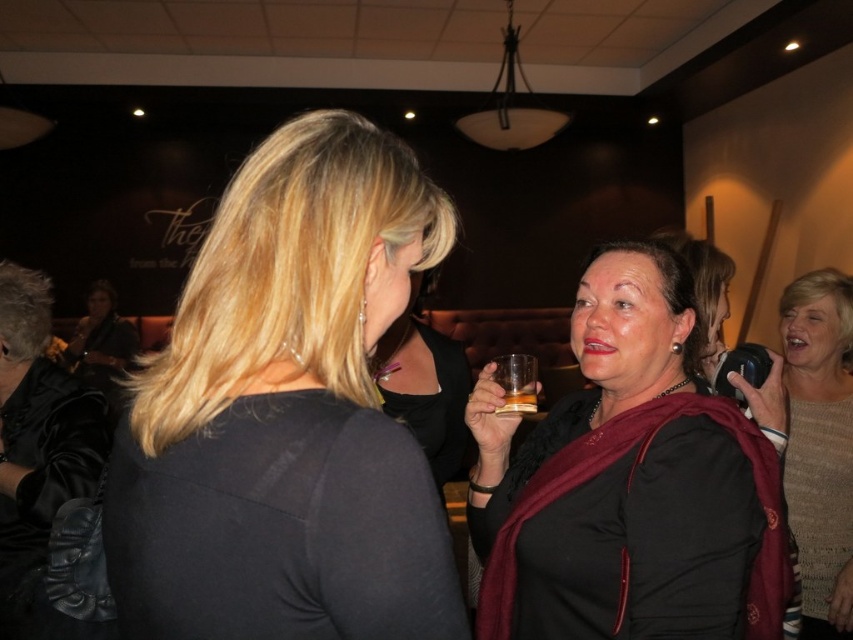
Question: Which of the following is the farthest from the observer?

Choices:
 (A) knitted beige sweater at right
 (B) matte black shirt at center
 (C) matte black guitar at left

Answer: (C)

Question: Which object is farther from the camera taking this photo?

Choices:
 (A) satin black jacket at upper left
 (B) matte black shirt at center

Answer: (A)

Question: Which point is farther to the camera?

Choices:
 (A) (126, 323)
 (B) (825, 570)
 (C) (82, 438)
 (D) (625, 518)

Answer: (A)

Question: Does knitted beige sweater at right lie behind translucent glass at center?

Choices:
 (A) no
 (B) yes

Answer: (B)

Question: Is matte black shirt at center positioned behind knitted beige sweater at right?

Choices:
 (A) no
 (B) yes

Answer: (A)

Question: Is knitted beige sweater at right in front of matte black guitar at left?

Choices:
 (A) yes
 (B) no

Answer: (A)